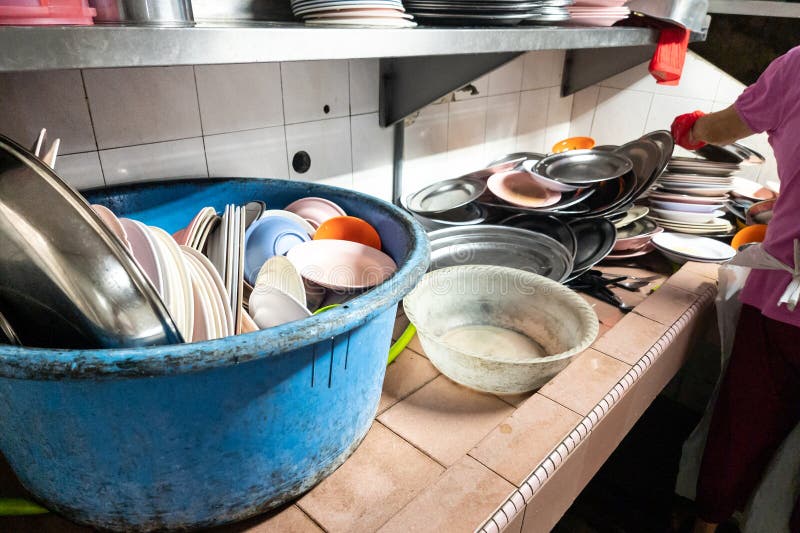
Identify the location of counter edge. Image resolution: width=800 pixels, height=533 pixels. (497, 520), (534, 476), (580, 423), (614, 390), (646, 359), (676, 327).